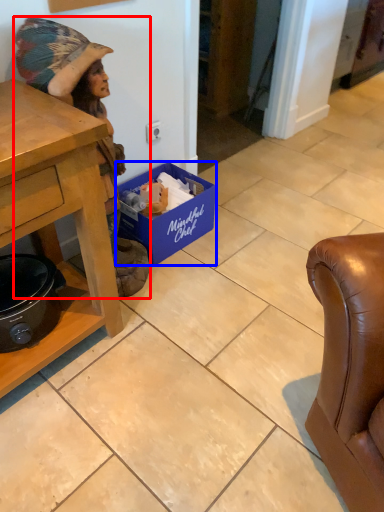
Question: Which point is closer to the camera, person (highlighted by a red box) or box (highlighted by a blue box)?

Choices:
 (A) person
 (B) box

Answer: (A)